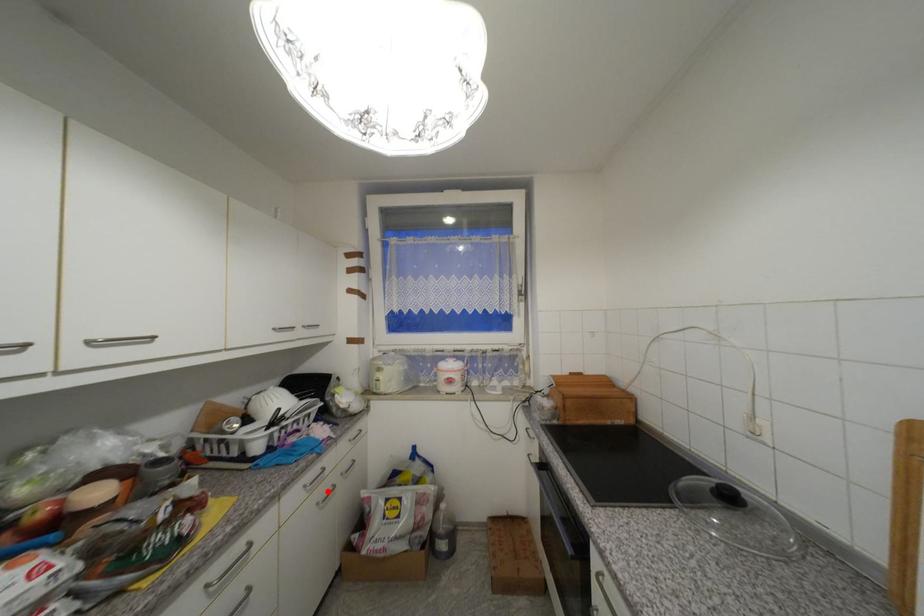
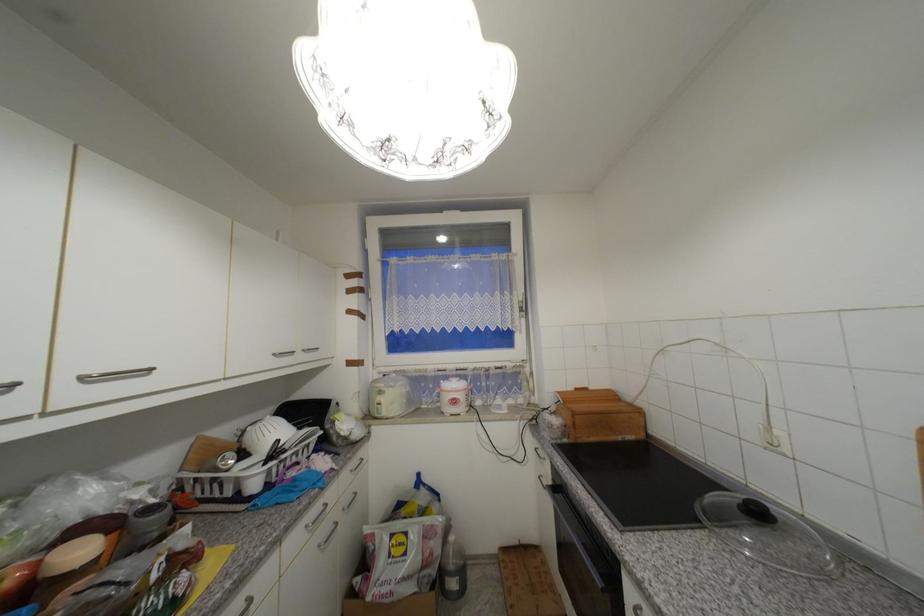
Question: I am providing you with two images of the same scene from different viewpoints. A red point is marked on the first image. Is the red point's position out of view in image 2?

Choices:
 (A) Yes
 (B) No

Answer: (B)